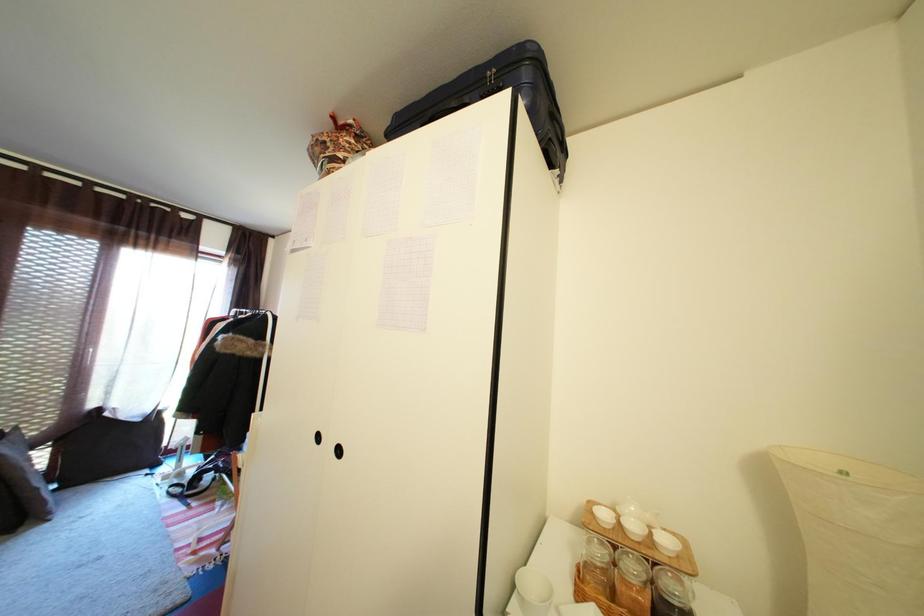
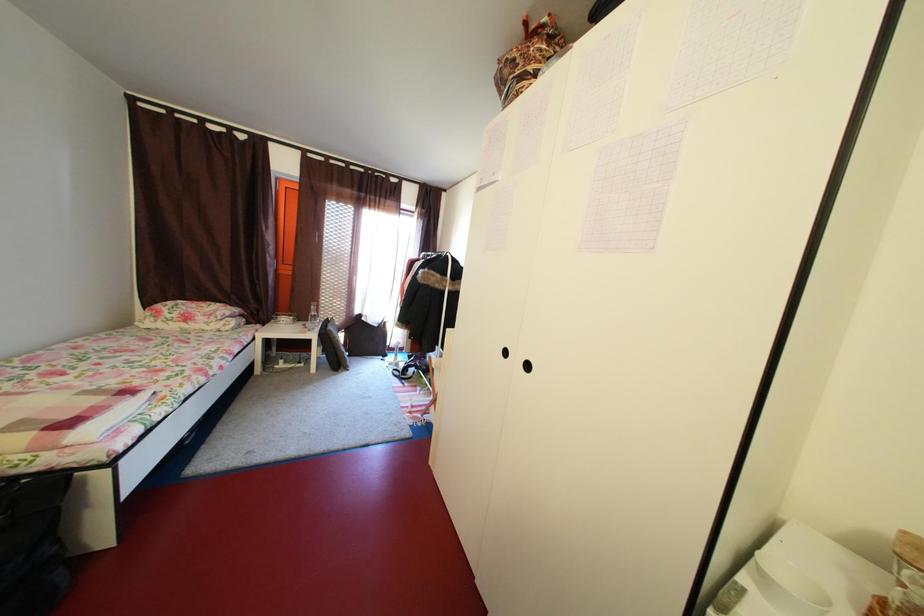
Question: The camera is either moving clockwise (left) or counter-clockwise (right) around the object. The first image is from the beginning of the video and the second image is from the end. Is the camera moving left or right when shooting the video?

Choices:
 (A) Left
 (B) Right

Answer: (B)